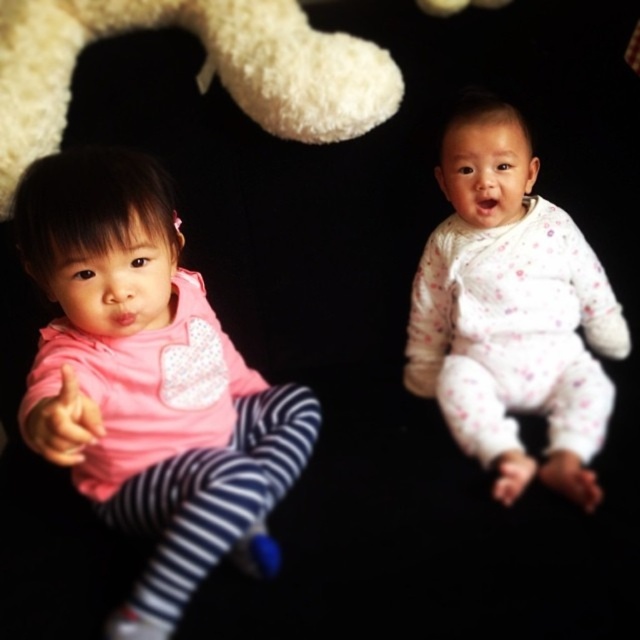
Can you confirm if white dotted onesie at upper right is taller than white fluffy teddy bear at upper left?

Indeed, white dotted onesie at upper right has a greater height compared to white fluffy teddy bear at upper left.

Is white dotted onesie at upper right above white fluffy teddy bear at upper left?

No.

In order to click on white dotted onesie at upper right in this screenshot , I will do `click(512, 310)`.

I want to click on white dotted onesie at upper right, so click(x=512, y=310).

Which is behind, point (64, 163) or point (337, 67)?

The point (337, 67) is more distant.

Image resolution: width=640 pixels, height=640 pixels. What are the coordinates of `pink fabric shirt at left` in the screenshot? It's located at (148, 381).

Does pink fabric shirt at left have a greater width compared to white dotted onesie at upper right?

In fact, pink fabric shirt at left might be narrower than white dotted onesie at upper right.

Image resolution: width=640 pixels, height=640 pixels. Describe the element at coordinates (148, 381) in the screenshot. I see `pink fabric shirt at left` at that location.

You are a GUI agent. You are given a task and a screenshot of the screen. Output one action in this format:
    pyautogui.click(x=<x>, y=<y>)
    Task: Click on the pink fabric shirt at left
    
    Given the screenshot: What is the action you would take?
    pyautogui.click(x=148, y=381)